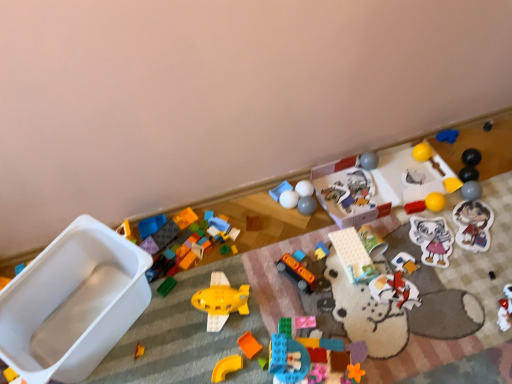
Find the location of a particular element. This screenshot has height=384, width=512. free area in between rubber duck at center, which ranks as the eleventh toy in right-to-left order, and matte gray ball at right, the 2th toy from the right is located at coordinates (392, 228).